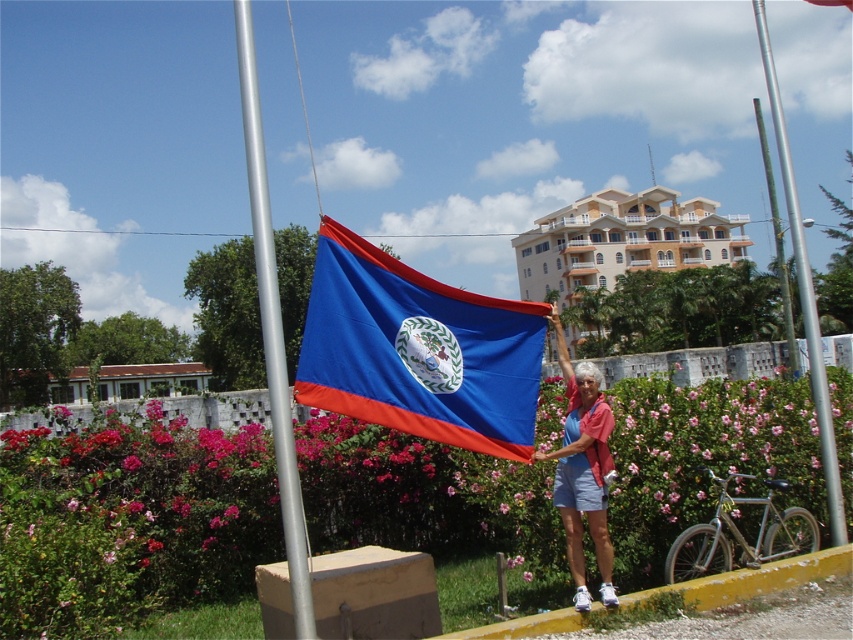
Question: Does silver metallic flag pole at left appear under matte blue shorts at center?

Choices:
 (A) no
 (B) yes

Answer: (A)

Question: Observing the image, what is the correct spatial positioning of silver metallic flag pole at left in reference to silver metallic pole at center?

Choices:
 (A) below
 (B) above

Answer: (A)

Question: Which of the following is the closest to the observer?

Choices:
 (A) (792, 189)
 (B) (445, 323)
 (C) (788, 344)
 (D) (592, 486)

Answer: (B)

Question: Observing the image, what is the correct spatial positioning of blue fabric flag at center in reference to matte blue shorts at center?

Choices:
 (A) right
 (B) left

Answer: (B)

Question: Among these objects, which one is nearest to the camera?

Choices:
 (A) blue fabric flag at center
 (B) green patina pole at upper right
 (C) silver metallic pole at center
 (D) silver metallic flag pole at left

Answer: (D)

Question: Which point appears farthest from the camera in this image?

Choices:
 (A) (786, 339)
 (B) (811, 358)
 (C) (592, 540)

Answer: (A)